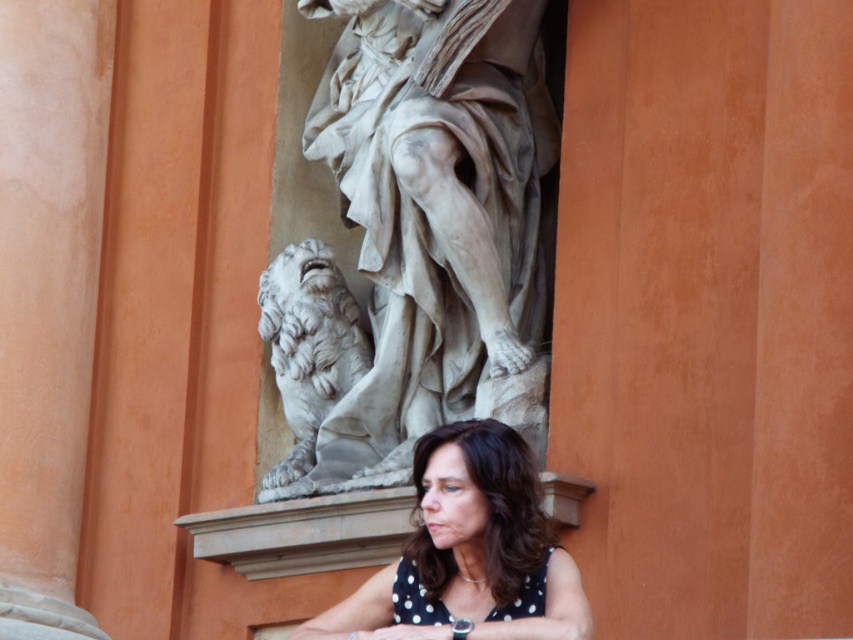
Who is lower down, white marble statue at center or polka dot fabric at center?

polka dot fabric at center is below.

Does white marble statue at center appear on the left side of polka dot fabric at center?

Indeed, white marble statue at center is positioned on the left side of polka dot fabric at center.

What do you see at coordinates (430, 221) in the screenshot? I see `white marble statue at center` at bounding box center [430, 221].

Identify the location of white marble statue at center. (430, 221).